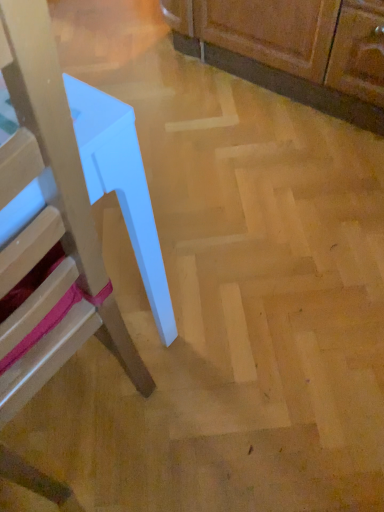
Where is `matte white chair at left`? This screenshot has height=512, width=384. matte white chair at left is located at coordinates (48, 227).

This screenshot has height=512, width=384. What do you see at coordinates (48, 227) in the screenshot? I see `matte white chair at left` at bounding box center [48, 227].

Image resolution: width=384 pixels, height=512 pixels. I want to click on matte white chair at left, so click(48, 227).